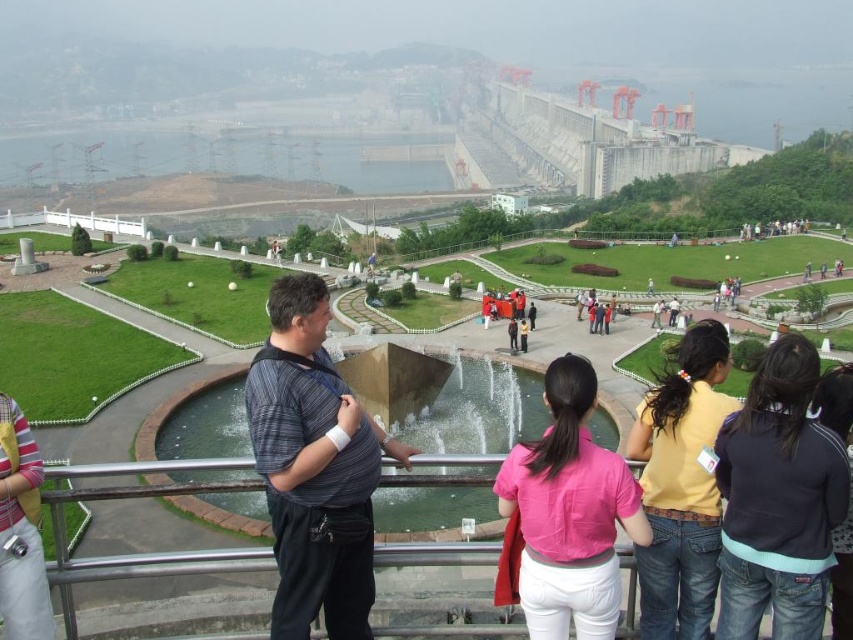
Question: Among these objects, which one is nearest to the camera?

Choices:
 (A) dark gray sweatshirt at lower right
 (B) brushed metal camera at lower left

Answer: (A)

Question: Among these points, which one is farthest from the camera?

Choices:
 (A) (259, 442)
 (B) (837, 422)

Answer: (A)

Question: Does pink fabric shirt at center lie behind black fleece jacket at lower right?

Choices:
 (A) yes
 (B) no

Answer: (A)

Question: Is striped fabric baby carrier at center wider than black fleece jacket at lower right?

Choices:
 (A) yes
 (B) no

Answer: (A)

Question: Which of the following is the farthest from the observer?

Choices:
 (A) (836, 605)
 (B) (22, 532)
 (C) (544, 600)

Answer: (C)

Question: Considering the relative positions of pink fabric shirt at center and black fleece jacket at lower right in the image provided, where is pink fabric shirt at center located with respect to black fleece jacket at lower right?

Choices:
 (A) left
 (B) right

Answer: (A)